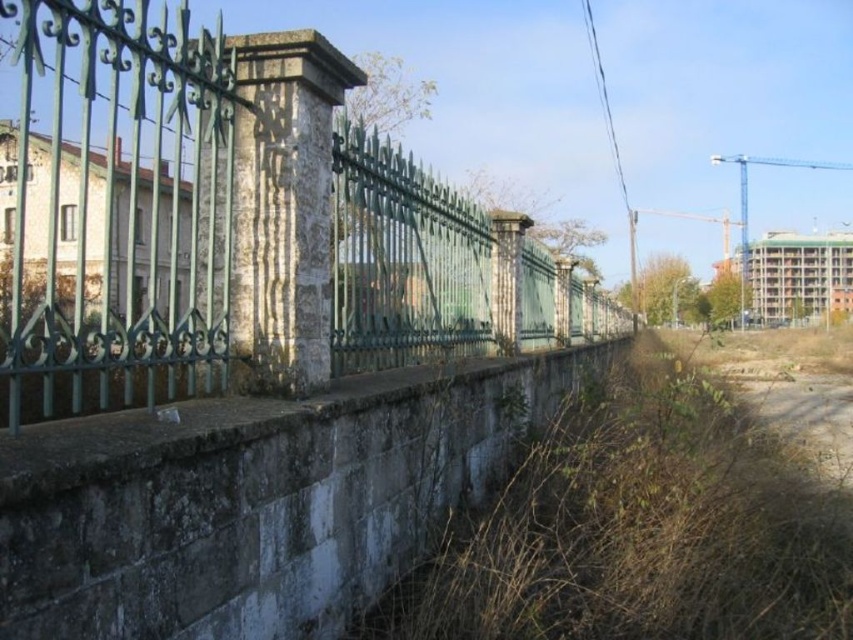
Question: Which object appears closest to the camera in this image?

Choices:
 (A) brown dry grass at lower right
 (B) green wrought iron fence at left

Answer: (B)

Question: Which object appears closest to the camera in this image?

Choices:
 (A) green wrought iron fence at left
 (B) brown dry grass at lower right

Answer: (A)

Question: Is green wrought iron fence at left thinner than brown dry grass at lower right?

Choices:
 (A) yes
 (B) no

Answer: (B)

Question: Can you confirm if green wrought iron fence at left is positioned to the left of brown dry grass at lower right?

Choices:
 (A) no
 (B) yes

Answer: (B)

Question: Which of the following is the farthest from the observer?

Choices:
 (A) (231, 184)
 (B) (770, 451)

Answer: (B)

Question: Is green wrought iron fence at left above brown dry grass at lower right?

Choices:
 (A) yes
 (B) no

Answer: (A)